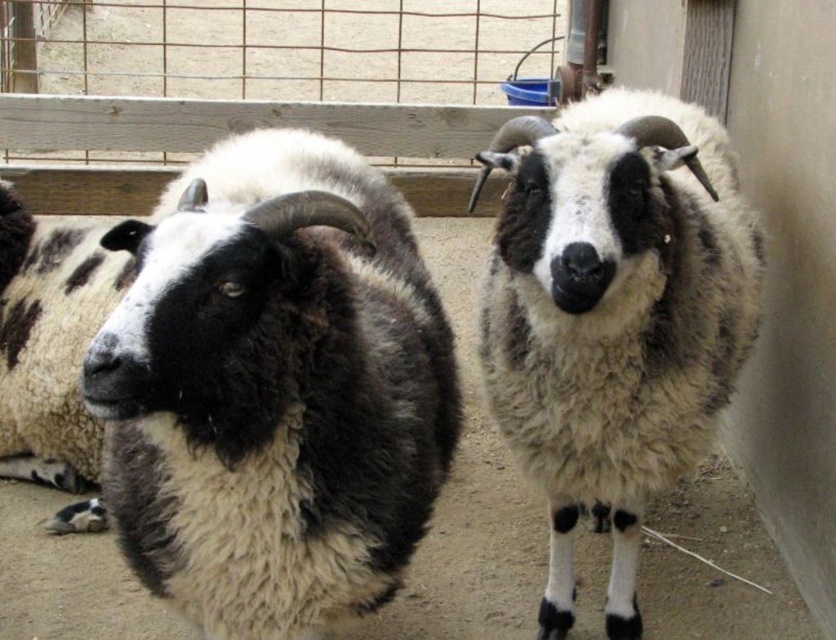
Can you confirm if fluffy woolen sheep at center is bigger than fluffy white wool at left?

Yes, fluffy woolen sheep at center is bigger than fluffy white wool at left.

Who is more distant from viewer, (686, 230) or (60, 385)?

The point (60, 385) is more distant.

Where is `fluffy woolen sheep at center`? Image resolution: width=836 pixels, height=640 pixels. fluffy woolen sheep at center is located at coordinates (613, 316).

Is black and white woolen goat at center below fluffy woolen sheep at center?

Actually, black and white woolen goat at center is above fluffy woolen sheep at center.

Is the position of black and white woolen goat at center less distant than that of fluffy woolen sheep at center?

Yes, it is.

Is point (314, 300) more distant than point (558, 502)?

That is False.

Locate an element on the screen. black and white woolen goat at center is located at coordinates (273, 388).

Can you confirm if black and white woolen goat at center is positioned below fluffy white wool at left?

Actually, black and white woolen goat at center is above fluffy white wool at left.

Is point (414, 429) behind point (65, 508)?

No, it is in front of (65, 508).

At what (x,y) coordinates should I click in order to perform the action: click on black and white woolen goat at center. Please return your answer as a coordinate pair (x, y). The height and width of the screenshot is (640, 836). Looking at the image, I should click on (273, 388).